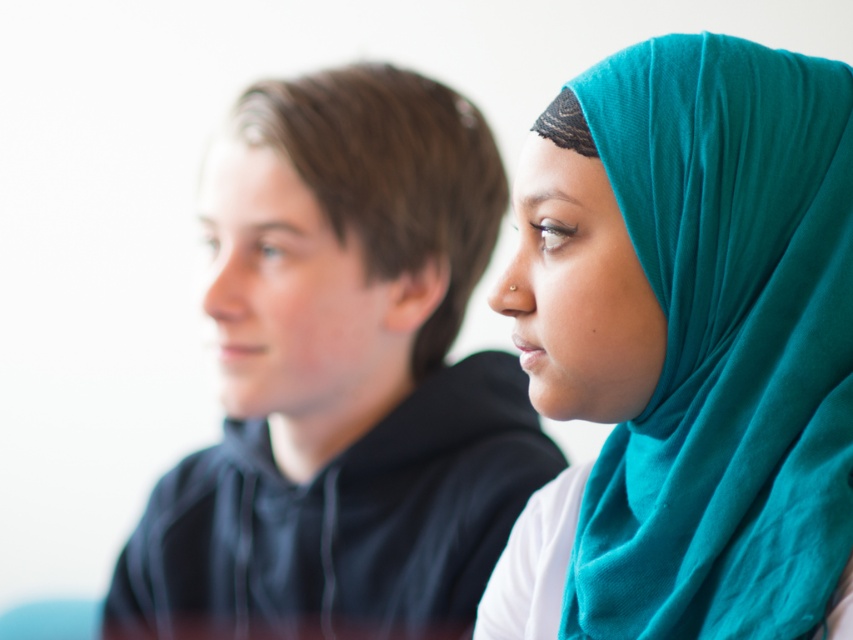
Find the location of a particular element. This screenshot has width=853, height=640. teal fabric hijab at right is located at coordinates (694, 339).

Image resolution: width=853 pixels, height=640 pixels. What are the coordinates of `teal fabric hijab at right` in the screenshot? It's located at (694, 339).